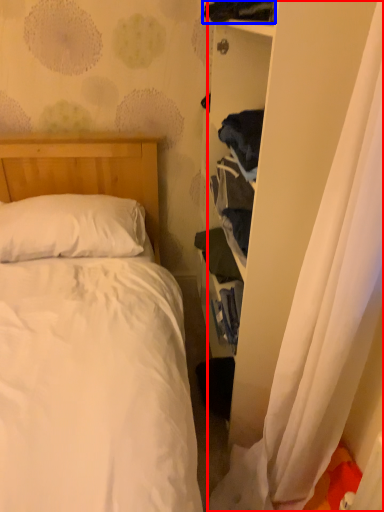
Question: Which object is closer to the camera taking this photo, curtain (highlighted by a red box) or clothing (highlighted by a blue box)?

Choices:
 (A) curtain
 (B) clothing

Answer: (A)